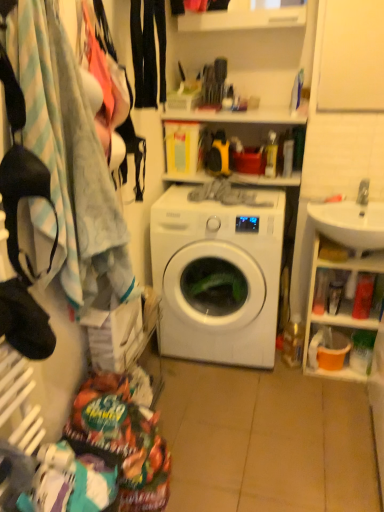
This screenshot has width=384, height=512. In order to click on free space to the left of white glossy cabinet at right in this screenshot , I will do `click(290, 379)`.